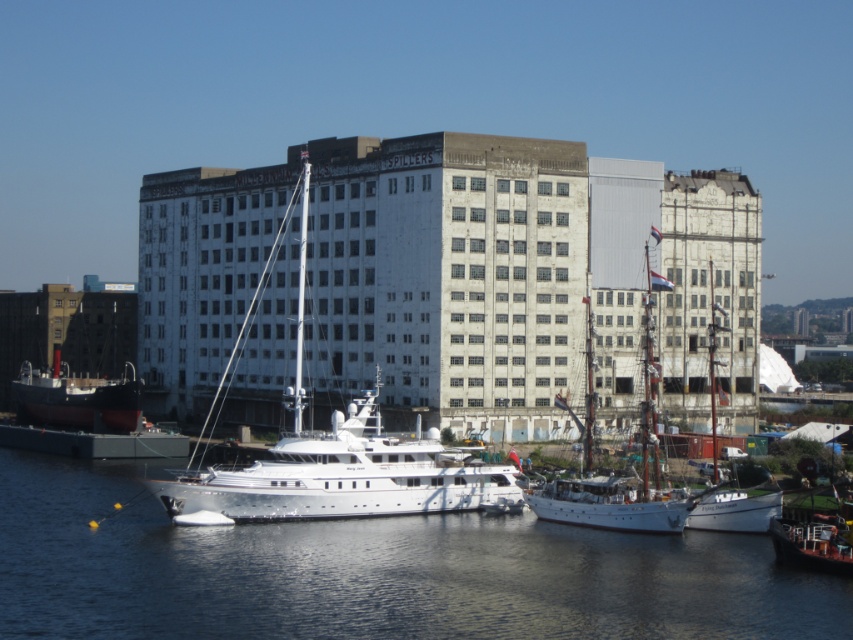
Question: Which of the following is the farthest from the observer?

Choices:
 (A) wooden sailboat at center
 (B) white wooden sailboat at right
 (C) metallic silver boat at lower right
 (D) white glossy sailboat at center

Answer: (D)

Question: Is white glossy sailboat at center above wooden sailboat at center?

Choices:
 (A) yes
 (B) no

Answer: (A)

Question: Which object is the closest to the white glossy sailboat at center?

Choices:
 (A) red matte ship at lower left
 (B) white wooden sailboat at right
 (C) wooden sailboat at center

Answer: (C)

Question: Is red matte ship at lower left smaller than white wooden sailboat at right?

Choices:
 (A) yes
 (B) no

Answer: (A)

Question: Which is nearer to the wooden sailboat at center?

Choices:
 (A) white wooden sailboat at right
 (B) clear blue water at lower center

Answer: (A)

Question: Does wooden sailboat at center appear over white wooden sailboat at right?

Choices:
 (A) no
 (B) yes

Answer: (B)